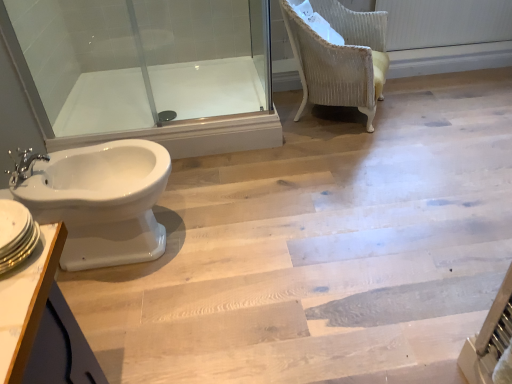
Question: Is white glossy bidet at lower left surrounded by white glossy bidet at left?

Choices:
 (A) yes
 (B) no

Answer: (B)

Question: Are white glossy bidet at left and white glossy bidet at lower left beside each other?

Choices:
 (A) no
 (B) yes

Answer: (A)

Question: Is white glossy bidet at left positioned in front of white glossy bidet at lower left?

Choices:
 (A) no
 (B) yes

Answer: (B)

Question: Is white glossy bidet at left positioned behind white glossy bidet at lower left?

Choices:
 (A) no
 (B) yes

Answer: (A)

Question: From a real-world perspective, is white glossy bidet at left located higher than white glossy bidet at lower left?

Choices:
 (A) yes
 (B) no

Answer: (B)

Question: Considering the positions of white glossy bathtub at upper left and white glossy sink at lower left in the image, is white glossy bathtub at upper left taller or shorter than white glossy sink at lower left?

Choices:
 (A) short
 (B) tall

Answer: (B)

Question: From a real-world perspective, is white glossy bathtub at upper left physically located above or below white glossy sink at lower left?

Choices:
 (A) below
 (B) above

Answer: (A)

Question: In terms of size, does white glossy bathtub at upper left appear bigger or smaller than white glossy sink at lower left?

Choices:
 (A) small
 (B) big

Answer: (B)

Question: Is white glossy bathtub at upper left inside or outside of white glossy sink at lower left?

Choices:
 (A) outside
 (B) inside

Answer: (A)

Question: Does point (207, 84) appear closer or farther from the camera than point (248, 276)?

Choices:
 (A) closer
 (B) farther

Answer: (B)

Question: Looking at the image, does white glossy bathtub at upper left seem bigger or smaller compared to white glossy bidet at left?

Choices:
 (A) small
 (B) big

Answer: (A)

Question: Would you say white glossy bathtub at upper left is to the left or to the right of white glossy bidet at left in the picture?

Choices:
 (A) left
 (B) right

Answer: (A)

Question: From a real-world perspective, relative to white glossy bidet at left, is white glossy bathtub at upper left vertically above or below?

Choices:
 (A) below
 (B) above

Answer: (B)

Question: Is white glossy bathtub at upper left wider or thinner than velvet yellow chair at upper right?

Choices:
 (A) wide
 (B) thin

Answer: (A)

Question: From the image's perspective, is white glossy bathtub at upper left above or below velvet yellow chair at upper right?

Choices:
 (A) below
 (B) above

Answer: (A)